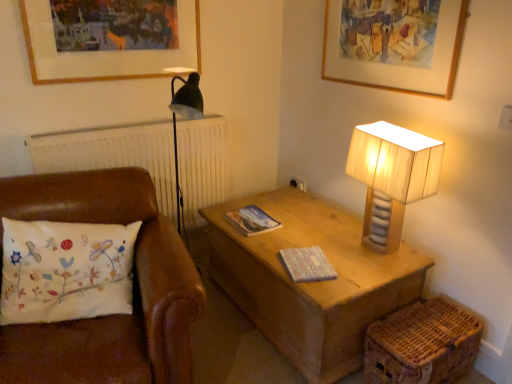
Identify the location of free space above matte paper magazine at center, which is the first magazine from back to front (from a real-world perspective). The height and width of the screenshot is (384, 512). (252, 221).